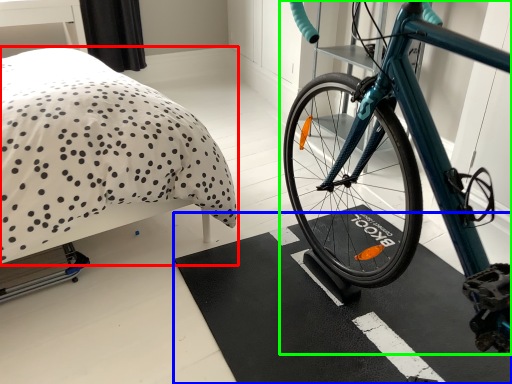
Question: Which object is the closest to the bed (highlighted by a red box)? Choose among these: bath mat (highlighted by a blue box) or bicycle (highlighted by a green box).

Choices:
 (A) bath mat
 (B) bicycle

Answer: (A)